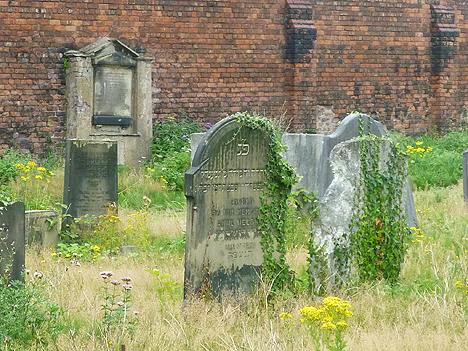
The image size is (468, 351). I want to click on brick wall, so click(x=265, y=75).